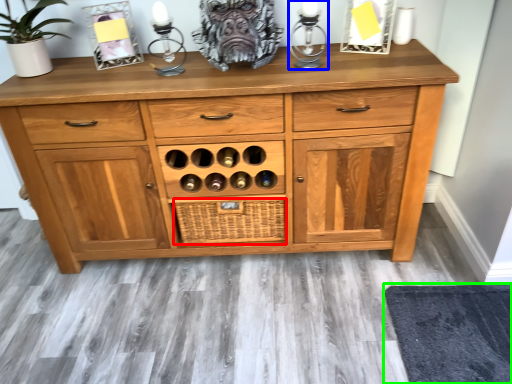
Question: Considering the real-world distances, which object is farthest from crate (highlighted by a red box)? candle holder (highlighted by a blue box) or mat (highlighted by a green box)?

Choices:
 (A) candle holder
 (B) mat

Answer: (B)